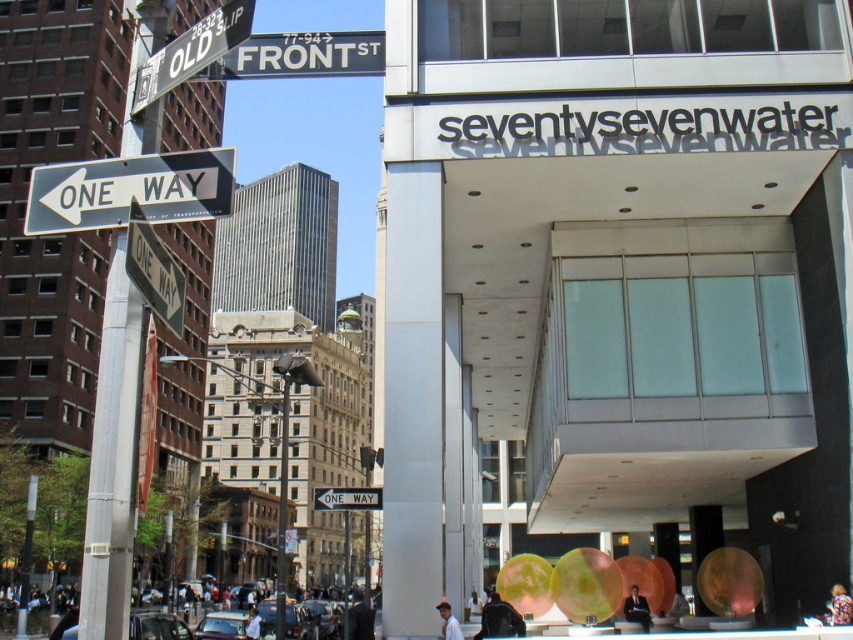
Is black plastic one way sign at left positioned in front of white plastic street sign at lower center?

Yes, black plastic one way sign at left is closer to the viewer.

The width and height of the screenshot is (853, 640). Identify the location of black plastic one way sign at left. (131, 189).

Is white plastic street sign at upper center behind metallic pole at center?

No, white plastic street sign at upper center is in front of metallic pole at center.

Where is `white plastic street sign at upper center`? This screenshot has width=853, height=640. white plastic street sign at upper center is located at coordinates (300, 54).

This screenshot has width=853, height=640. What do you see at coordinates (300, 54) in the screenshot? I see `white plastic street sign at upper center` at bounding box center [300, 54].

Locate an element on the screen. white plastic street sign at upper center is located at coordinates (300, 54).

Who is taller, black plastic one way sign at left or metallic silver street sign at upper left?

black plastic one way sign at left is taller.

Who is more distant from viewer, (181, 180) or (248, 10)?

The point (181, 180) is behind.

You are a GUI agent. You are given a task and a screenshot of the screen. Output one action in this format:
    pyautogui.click(x=<x>, y=<y>)
    Task: Click on the black plastic one way sign at left
    This screenshot has width=853, height=640.
    Given the screenshot: What is the action you would take?
    pyautogui.click(x=131, y=189)